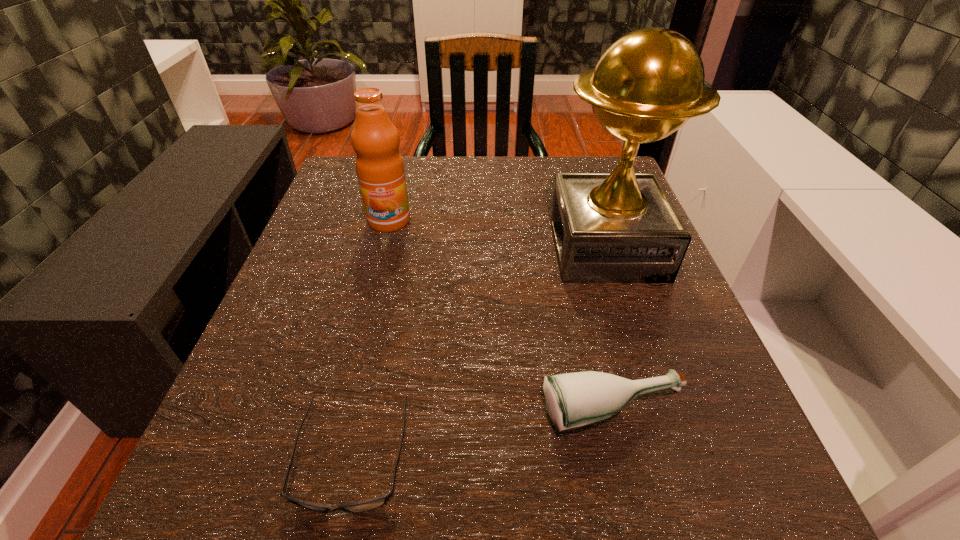
Find the location of a particular element. The width and height of the screenshot is (960, 540). award is located at coordinates click(621, 227).

Locate an element on the screen. The height and width of the screenshot is (540, 960). the third shortest object is located at coordinates (380, 170).

Locate an element on the screen. This screenshot has height=540, width=960. the third tallest object is located at coordinates click(573, 400).

This screenshot has height=540, width=960. I want to click on sunglasses, so click(x=369, y=504).

I want to click on vacant space positioned on the front-facing side of the award, so click(526, 248).

Identify the location of free location located on the front-facing side of the award. (425, 248).

This screenshot has height=540, width=960. I want to click on vacant space located on the front-facing side of the award, so click(359, 248).

The image size is (960, 540). Identify the location of free space located 0.170m on the label side of the fruit juice. [x=371, y=293].

The width and height of the screenshot is (960, 540). I want to click on free space located 0.200m on the left of the second shortest object, so click(398, 414).

At what (x,y) coordinates should I click in order to perform the action: click on object at the far edge. Please return your answer as a coordinate pair (x, y). This screenshot has height=540, width=960. Looking at the image, I should click on (380, 170).